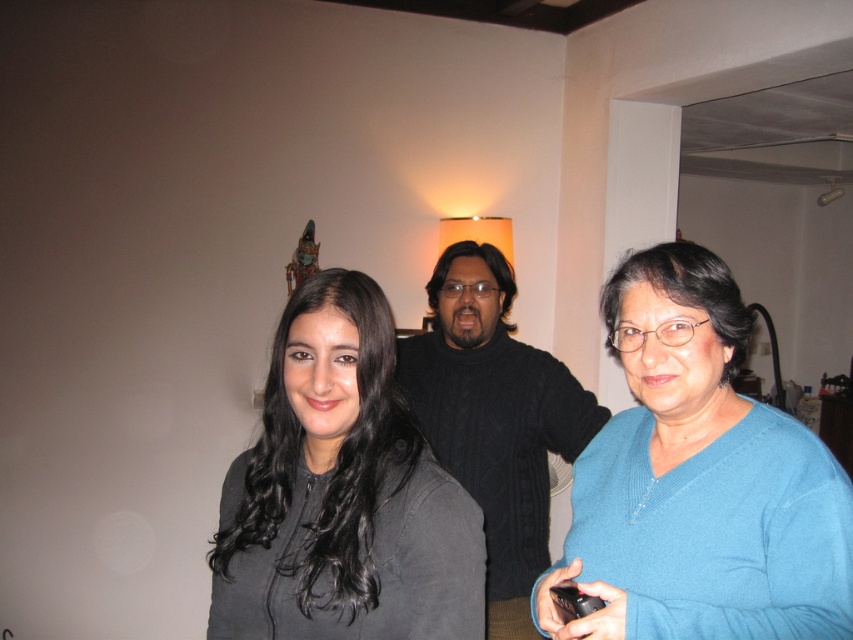
Who is more forward, (381, 513) or (517, 525)?

Point (381, 513) is more forward.

Is point (450, 612) positioned after point (517, 564)?

No, it is not.

Between point (349, 556) and point (592, 396), which one is positioned in front?

Positioned in front is point (349, 556).

Locate an element on the screen. The image size is (853, 640). matte gray sweater at center is located at coordinates (341, 493).

Find the location of `blue sweater at center`. blue sweater at center is located at coordinates (699, 480).

Is blue sweater at center wider than matte gray sweater at center?

Incorrect, blue sweater at center's width does not surpass matte gray sweater at center's.

Does point (701, 323) come closer to viewer compared to point (311, 305)?

That is False.

Where is `blue sweater at center`? This screenshot has width=853, height=640. blue sweater at center is located at coordinates (699, 480).

Can you confirm if blue sweater at center is bigger than black cable-knit sweater at center?

No.

Which is behind, point (666, 362) or point (508, 490)?

Positioned behind is point (508, 490).

Where is `blue sweater at center`? blue sweater at center is located at coordinates (699, 480).